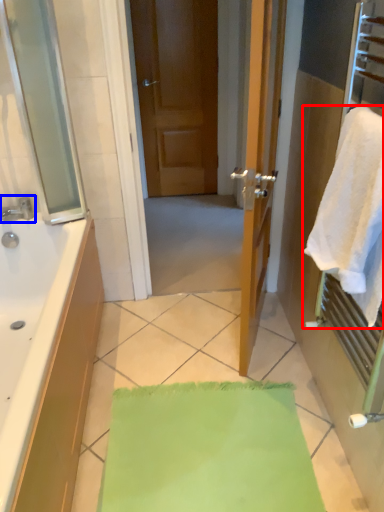
Question: Which object appears closest to the camera in this image, towel (highlighted by a red box) or tap (highlighted by a blue box)?

Choices:
 (A) towel
 (B) tap

Answer: (A)